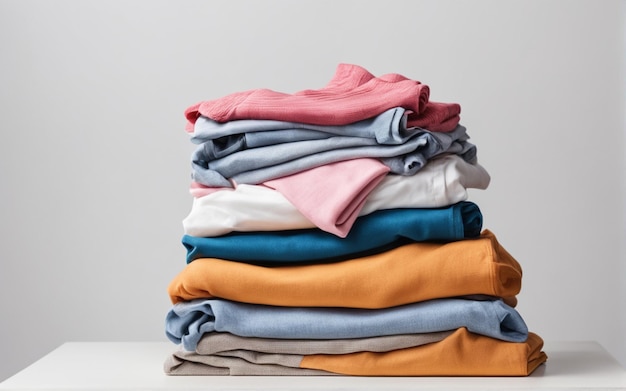
Identify the location of folded shirts. (466, 362), (379, 345), (379, 314), (387, 283), (396, 223), (411, 188), (357, 192), (389, 157), (340, 130), (337, 109).